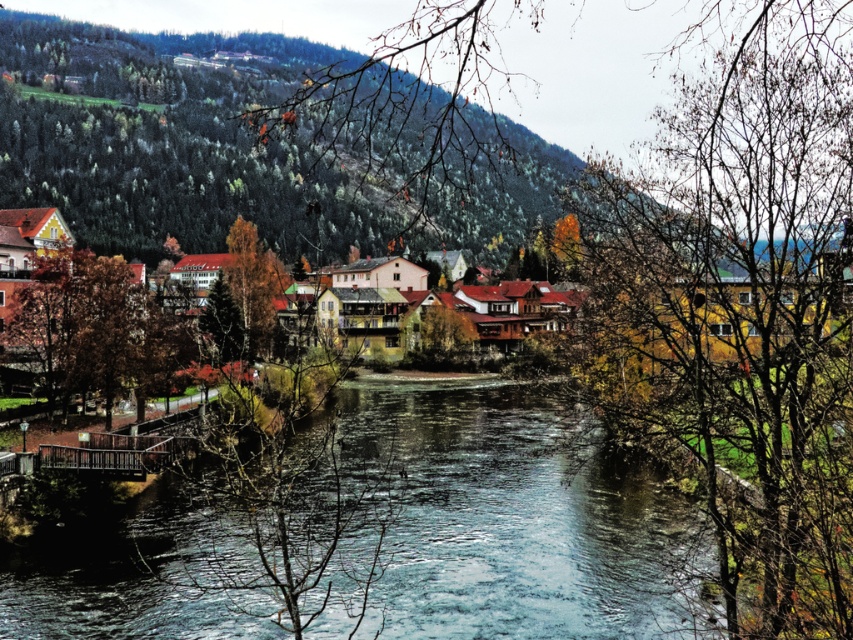
Does clear water stream at center come behind golden yellow leaves at center?

That is False.

You are a GUI agent. You are given a task and a screenshot of the screen. Output one action in this format:
    pyautogui.click(x=<x>, y=<y>)
    Task: Click on the clear water stream at center
    The height and width of the screenshot is (640, 853).
    Given the screenshot: What is the action you would take?
    pyautogui.click(x=514, y=520)

Who is shorter, bare branches at center or golden yellow leaves at center?

golden yellow leaves at center

Does point (688, 308) come behind point (271, 289)?

No.

Is point (788, 170) positioned behind point (244, 321)?

No, (788, 170) is closer to viewer.

Locate an element on the screen. bare branches at center is located at coordinates (740, 305).

How distant is bare branches at center from clear water stream at center?

A distance of 49.56 meters exists between bare branches at center and clear water stream at center.

Find the location of a particular element. The width and height of the screenshot is (853, 640). bare branches at center is located at coordinates (740, 305).

Find the location of a particular element. The height and width of the screenshot is (640, 853). bare branches at center is located at coordinates (740, 305).